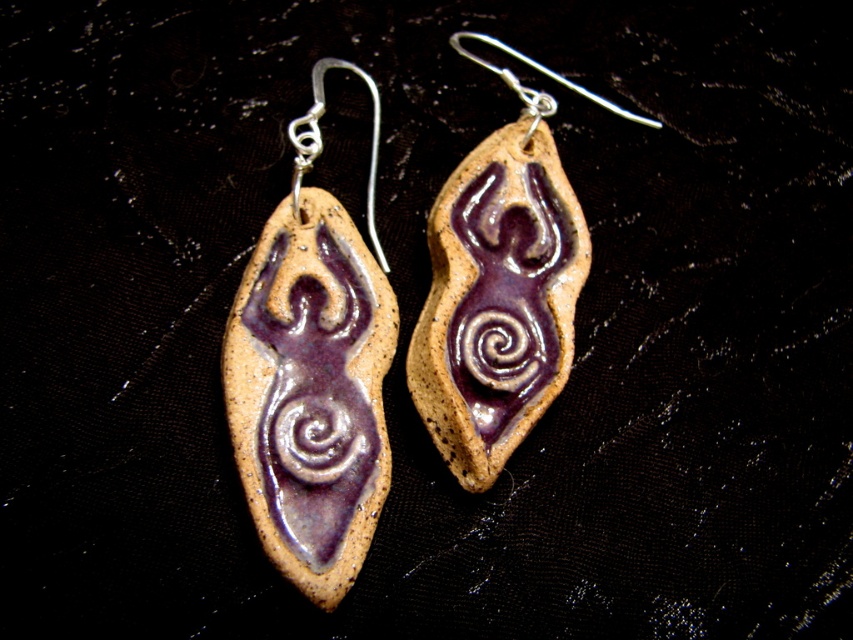
You are an appraiser examining the placement of the matte purple clay earring at left. Where exactly is it positioned in the image?

The matte purple clay earring at left is located at point coordinates of 0.583 on the x axis and 0.367 on the y axis.

You are an appraiser examining two earrings in the image. You need to determine which one is nearer to you. The two earrings are the matte purple clay earring at left and the purple clay earring at center. Which one is closer?

The matte purple clay earring at left is closer to the viewer than the purple clay earring at center.

You are an artisan examining the placement of the purple clay earring at center and the polished silver hook at upper center in the image. Which object is positioned higher on the earring?

The polished silver hook at upper center is positioned higher on the earring than the purple clay earring at center.